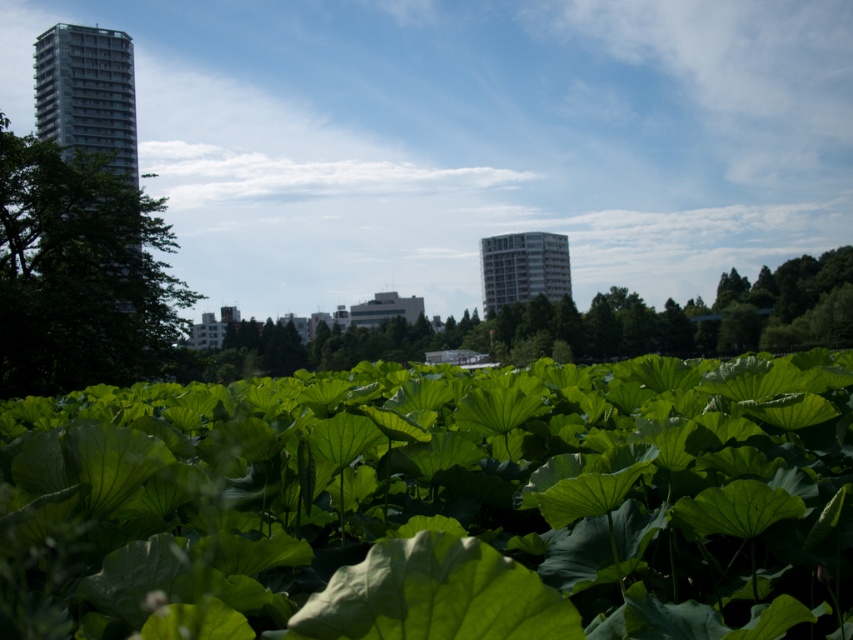
You are standing in the urban landscape and want to take a photo of both the green leafy tree at left and the green leafy plant at center. Which one should you position closer to the camera to include both in the frame without cropping?

To include both the green leafy tree at left and the green leafy plant at center in the frame without cropping, you should position the green leafy tree at left closer to the camera since it is already to the left of the green leafy plant at center.

You are standing in the urban landscape scene. There is a point marked at coordinates (79, 273). Which object from the scene does this point belong to?

The point at coordinates (79, 273) is located on the green leafy tree at the left.

You are standing in the urban landscape scene. You see the green leafy tree at left and the green leafy plant at center. Which one is closer to you?

The green leafy tree at left is positioned over the green leafy plant at center, meaning it is closer to you.